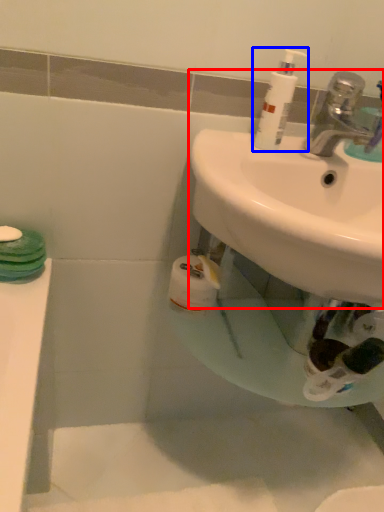
Question: Which of the following is the farthest to the observer, sink (highlighted by a red box) or cleaning product (highlighted by a blue box)?

Choices:
 (A) sink
 (B) cleaning product

Answer: (B)